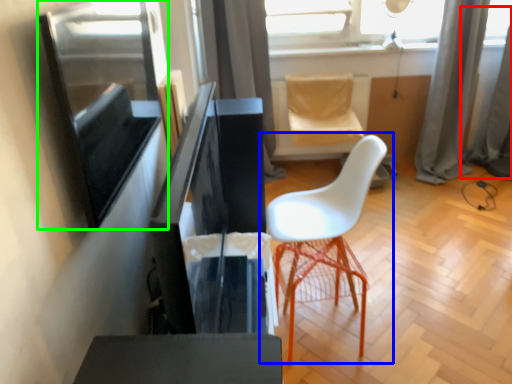
Question: Which object is positioned farthest from curtain (highlighted by a red box)? Select from chair (highlighted by a blue box) and window screen (highlighted by a green box).

Choices:
 (A) chair
 (B) window screen

Answer: (B)